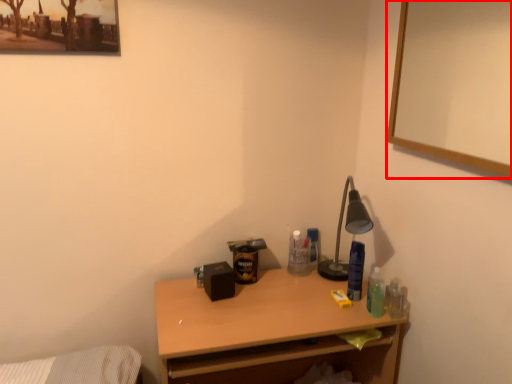
Question: From the image's perspective, where is picture frame (annotated by the red box) located relative to desk?

Choices:
 (A) below
 (B) above

Answer: (B)